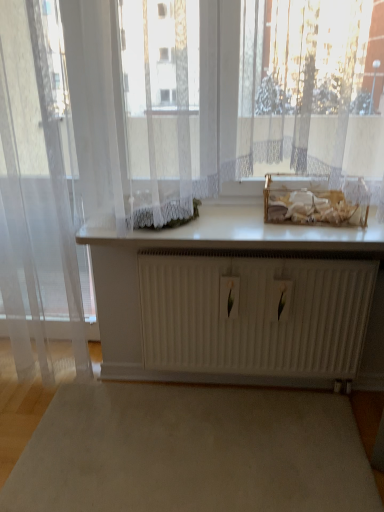
The height and width of the screenshot is (512, 384). Find the location of `free space above beige carpet at center (from a real-world perspective)`. free space above beige carpet at center (from a real-world perspective) is located at coordinates (186, 452).